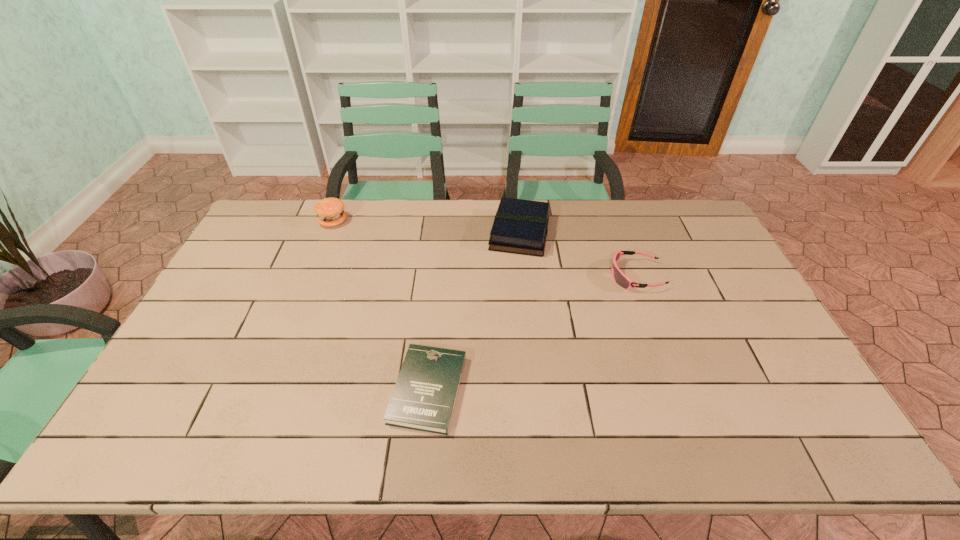
I want to click on vacant area situated on the front-facing side of the second shortest object, so click(x=569, y=275).

Image resolution: width=960 pixels, height=540 pixels. In order to click on free region located 0.060m on the front-facing side of the second shortest object in this screenshot , I will do `click(591, 275)`.

I want to click on vacant area situated on the front-facing side of the second shortest object, so click(496, 275).

You are a GUI agent. You are given a task and a screenshot of the screen. Output one action in this format:
    pyautogui.click(x=<x>, y=<y>)
    Task: Click on the free space located on the right of the shortest object
    
    Given the screenshot: What is the action you would take?
    pyautogui.click(x=517, y=390)

This screenshot has height=540, width=960. In order to click on patty at the far edge in this screenshot , I will do `click(330, 212)`.

The image size is (960, 540). Find the location of `book situated at the far edge`. book situated at the far edge is located at coordinates (520, 226).

Locate an element on the screen. The height and width of the screenshot is (540, 960). object located in the near edge section of the desktop is located at coordinates (424, 396).

In the image, there is a desktop. Find the location of `vacant space at the far edge`. vacant space at the far edge is located at coordinates (396, 232).

You are a GUI agent. You are given a task and a screenshot of the screen. Output one action in this format:
    pyautogui.click(x=<x>, y=<y>)
    Task: Click on the vacant space at the near edge of the desktop
    The height and width of the screenshot is (540, 960).
    Given the screenshot: What is the action you would take?
    pyautogui.click(x=531, y=434)

The height and width of the screenshot is (540, 960). In order to click on vacant space at the right edge of the desktop in this screenshot , I will do `click(706, 246)`.